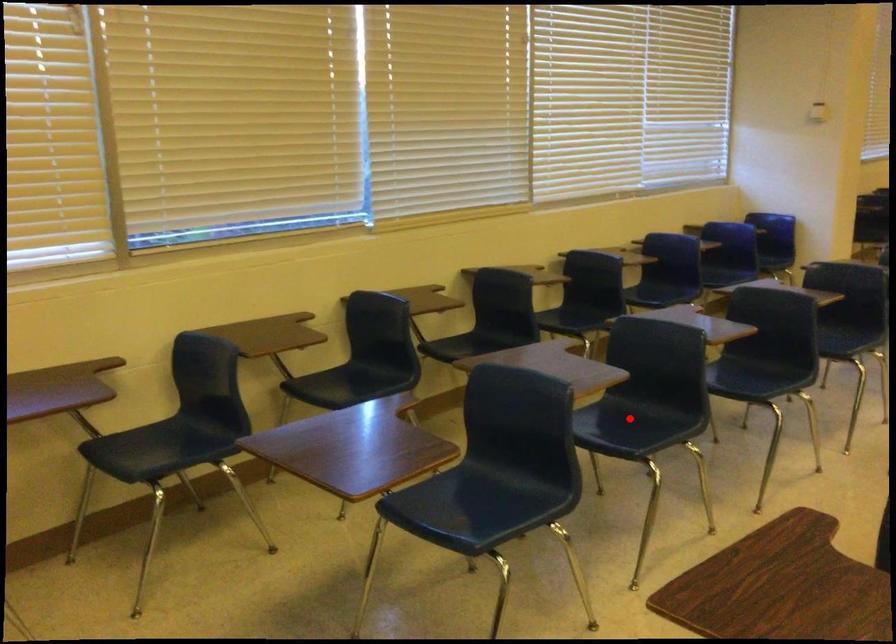
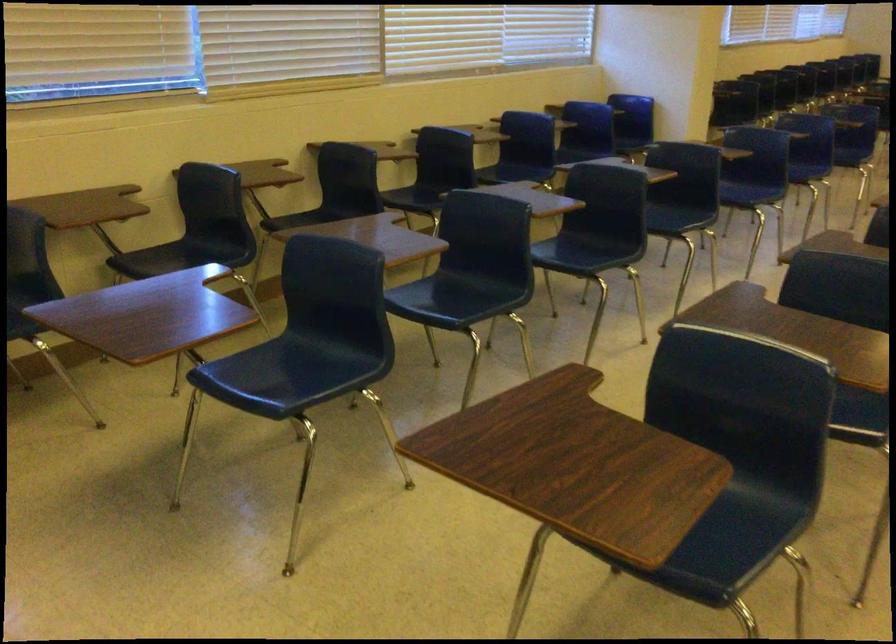
Find the pixel in the second image that matches the highlighted location in the first image.

(462, 292)